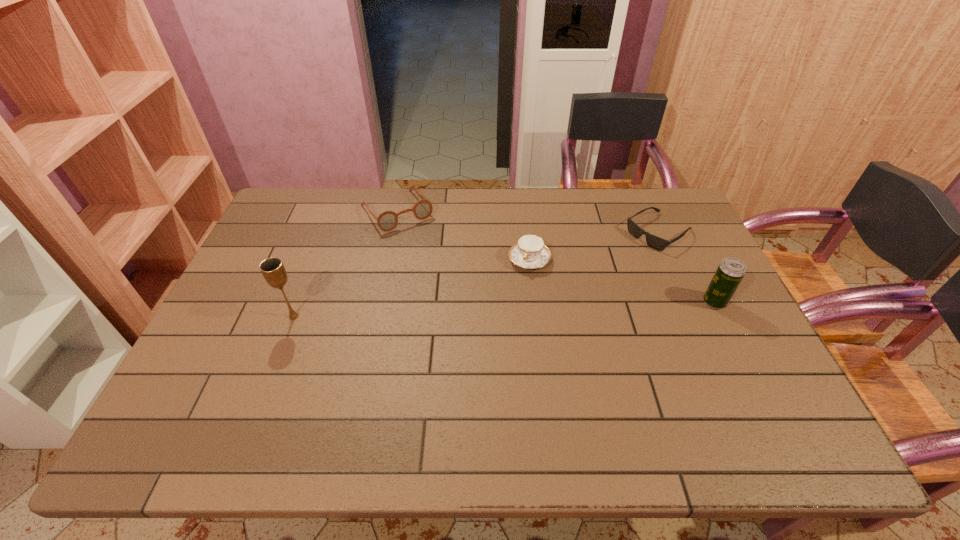
The height and width of the screenshot is (540, 960). I want to click on free spot on the desktop that is between the leftmost object and the fourth shortest object and is positioned on the side with the handle of the teacup, so click(x=505, y=309).

Locate an element on the screen. The width and height of the screenshot is (960, 540). vacant space on the desktop that is between the chalice and the beer can and is positioned on the front-facing side of the spectacles is located at coordinates (470, 310).

Identify the location of free spot on the desktop that is between the chalice and the beer can and is positioned on the front-facing side of the sunglasses. The width and height of the screenshot is (960, 540). [546, 308].